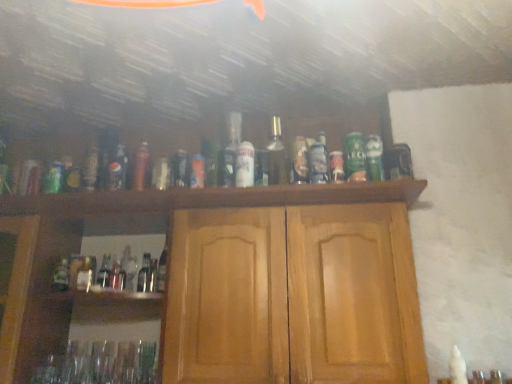
Image resolution: width=512 pixels, height=384 pixels. In order to click on vacant space behind metallic silver can at center, marked as the first bottle in a right-to-left arrangement in this screenshot , I will do `click(311, 191)`.